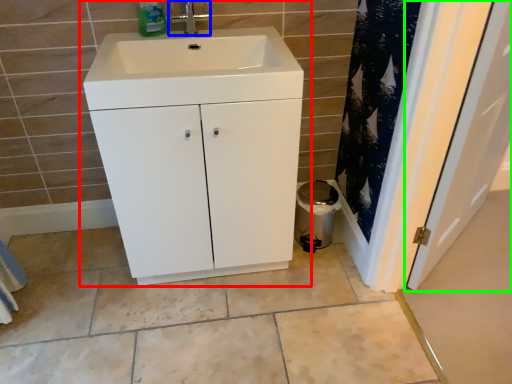
Question: Which is nearer to the bathroom cabinet (highlighted by a red box)? tap (highlighted by a blue box) or door (highlighted by a green box).

Choices:
 (A) tap
 (B) door

Answer: (A)